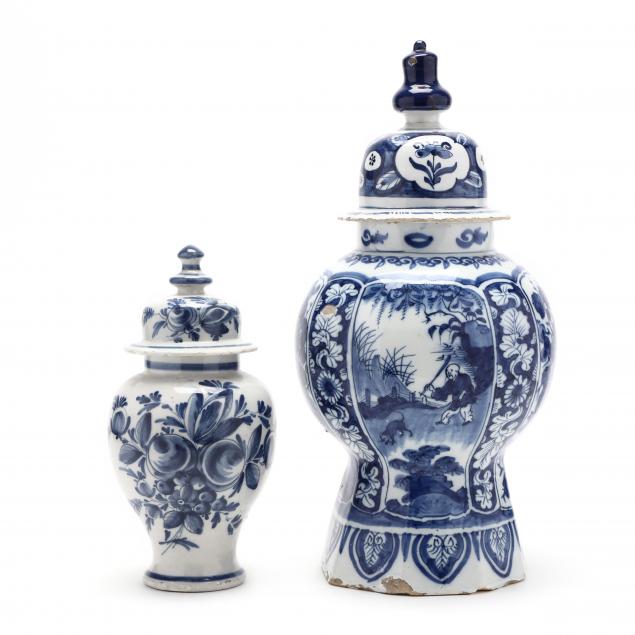
Image resolution: width=635 pixels, height=635 pixels. I want to click on vase, so click(x=432, y=344).